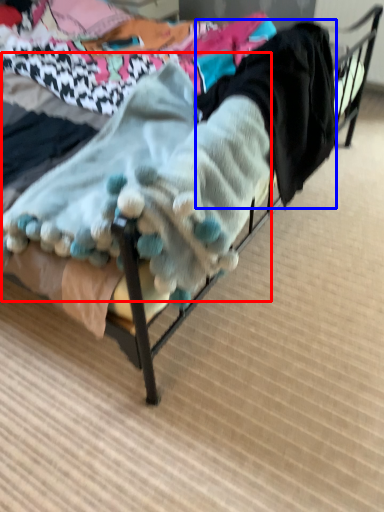
Question: Which point is closer to the camera, baby clothe (highlighted by a red box) or clothing (highlighted by a blue box)?

Choices:
 (A) baby clothe
 (B) clothing

Answer: (A)